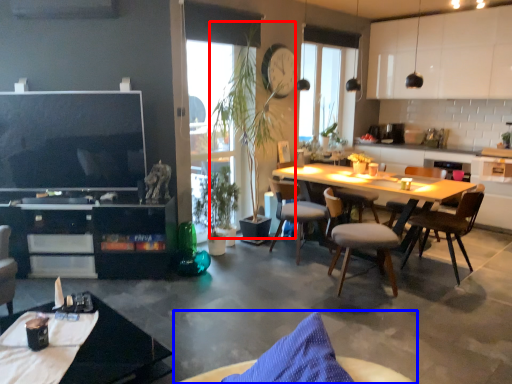
Question: Which object appears farthest to the camera in this image, plant (highlighted by a red box) or chair (highlighted by a blue box)?

Choices:
 (A) plant
 (B) chair

Answer: (A)